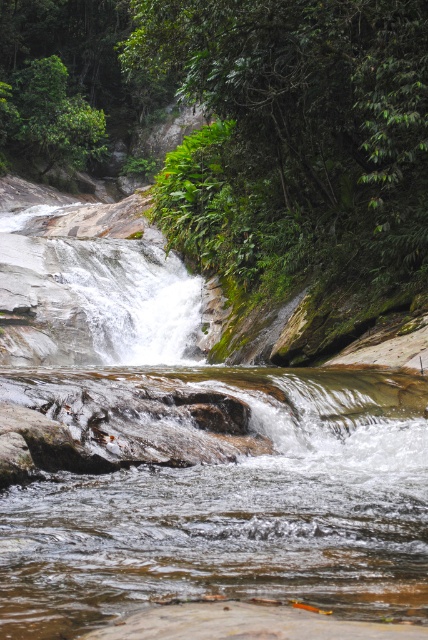
Which of these two, translucent wet rock at center or green leafy forest at upper center, stands taller?

Standing taller between the two is green leafy forest at upper center.

Measure the distance from translucent wet rock at center to green leafy forest at upper center.

A distance of 41.32 feet exists between translucent wet rock at center and green leafy forest at upper center.

Who is more distant from viewer, (112, 369) or (253, 186)?

The point (253, 186) is more distant.

In order to click on translucent wet rock at center in this screenshot , I will do `click(225, 502)`.